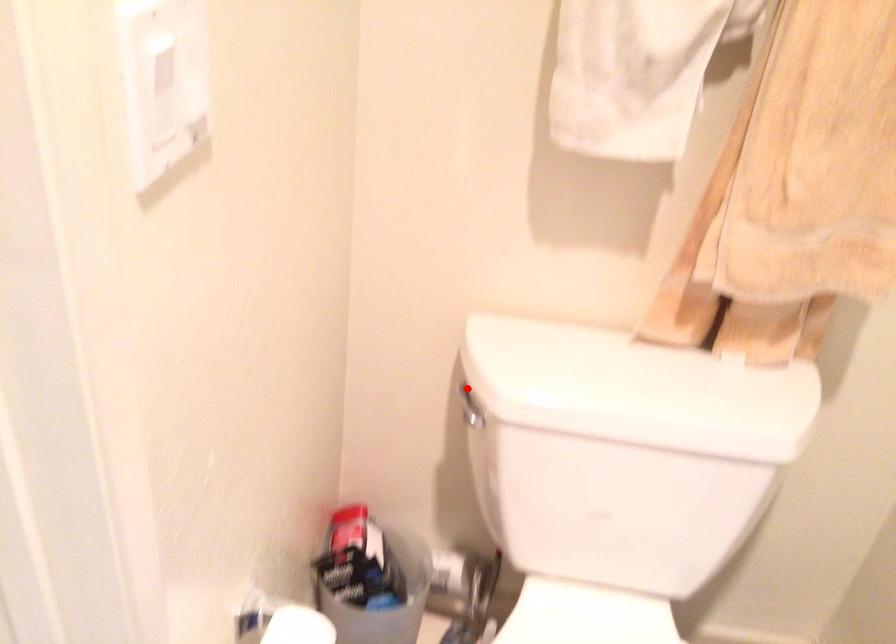
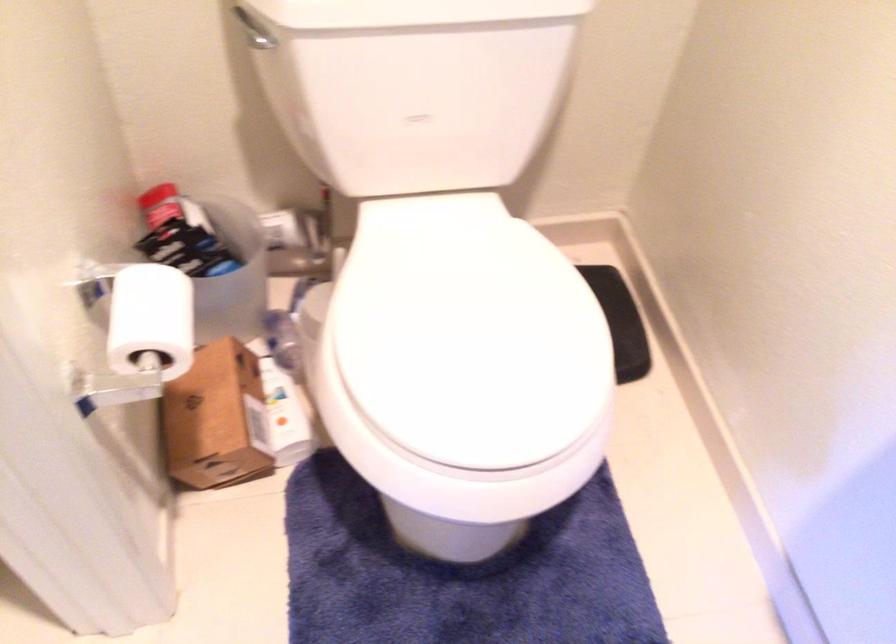
Question: A red point is marked in image1. In image2, is the corresponding 3D point closer to the camera or farther? Reply with the corresponding letter.

Choices:
 (A) The corresponding 3D point is closer.
 (B) The corresponding 3D point is farther.

Answer: (A)